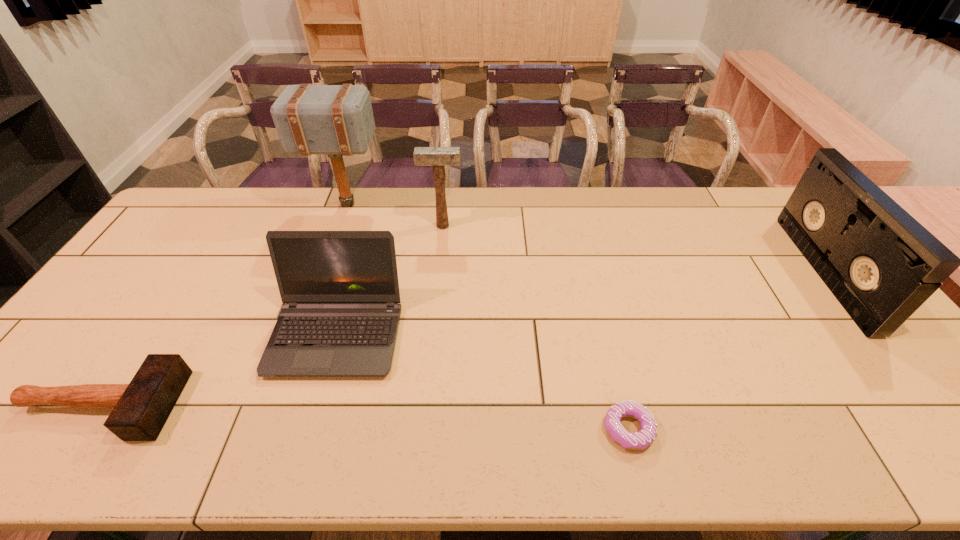
At what (x,y) coordinates should I click in order to perform the action: click on mallet that stands as the closest to the nearest mallet. Please return your answer as a coordinate pair (x, y). The height and width of the screenshot is (540, 960). Looking at the image, I should click on (337, 120).

Choose which mallet is the second nearest neighbor to the rightmost object. Please provide its 2D coordinates. Your answer should be formatted as a tuple, i.e. [(x, y)], where the tuple contains the x and y coordinates of a point satisfying the conditions above.

[(337, 120)]

Locate an element on the screen. This screenshot has height=540, width=960. blank space that satisfies the following two spatial constraints: 1. on the front side of the videotape; 2. on the screen of the third shortest object is located at coordinates (874, 334).

At what (x,y) coordinates should I click in order to perform the action: click on free space in the image that satisfies the following two spatial constraints: 1. on the striking surface of the farthest mallet; 2. on the right side of the rightmost mallet. Please return your answer as a coordinate pair (x, y). The width and height of the screenshot is (960, 540). Looking at the image, I should click on tap(339, 226).

Image resolution: width=960 pixels, height=540 pixels. In order to click on free spot that satisfies the following two spatial constraints: 1. on the striking surface of the rightmost mallet; 2. on the left side of the tallest mallet in this screenshot , I will do `click(339, 226)`.